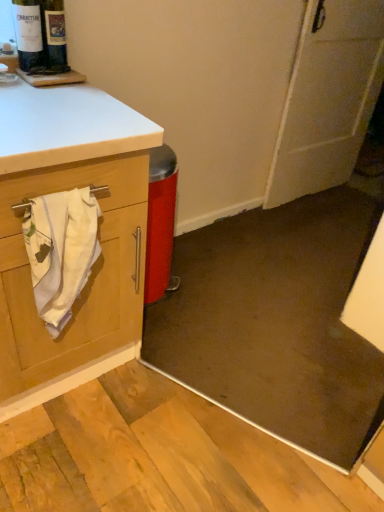
Question: Looking at the image, does white cotton towel at left seem bigger or smaller compared to matte glass bottle at upper left?

Choices:
 (A) small
 (B) big

Answer: (B)

Question: In terms of width, does white cotton towel at left look wider or thinner when compared to matte glass bottle at upper left?

Choices:
 (A) wide
 (B) thin

Answer: (A)

Question: Which object is positioned closest to the white cotton towel at left?

Choices:
 (A) matte glass wine bottle at upper left
 (B) matte glass bottle at upper left
 (C) white matte door at upper right

Answer: (B)

Question: Estimate the real-world distances between objects in this image. Which object is farther from the matte glass bottle at upper left?

Choices:
 (A) white cotton towel at left
 (B) white matte door at upper right
 (C) matte glass wine bottle at upper left

Answer: (B)